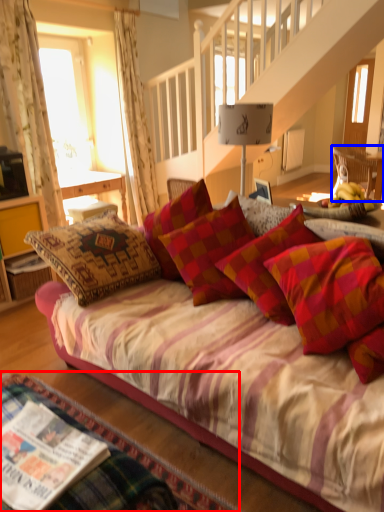
Question: Which object appears closest to the camera in this image, bed frame (highlighted by a red box) or chair (highlighted by a blue box)?

Choices:
 (A) bed frame
 (B) chair

Answer: (A)